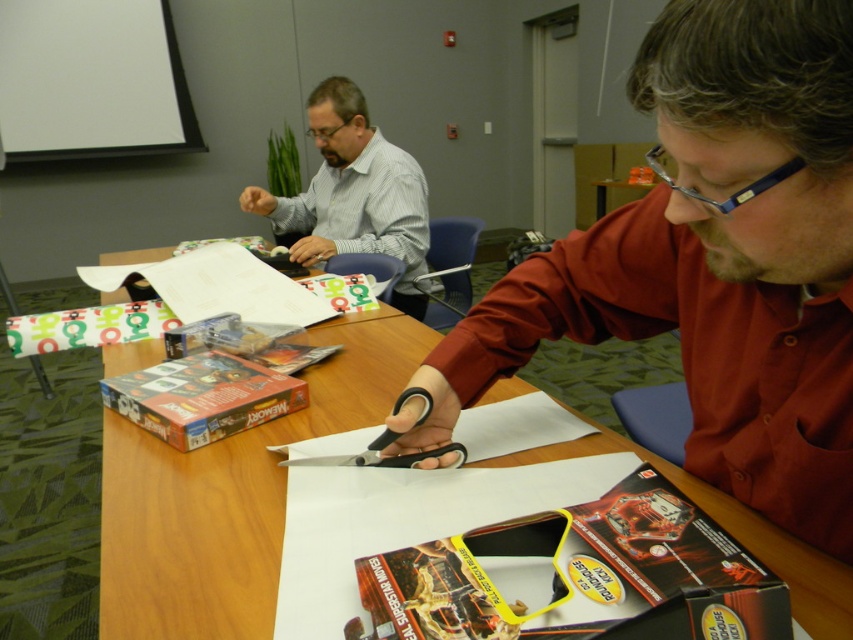
Question: Which of the following is the farthest from the observer?

Choices:
 (A) (525, 356)
 (B) (146, 397)

Answer: (B)

Question: Which point is farther to the camera?

Choices:
 (A) (813, 3)
 (B) (259, 408)

Answer: (B)

Question: Is matte plastic board game at center positioned before white paper at center?

Choices:
 (A) yes
 (B) no

Answer: (A)

Question: In this image, where is matte plastic board game at center located relative to matte gray shirt at upper left?

Choices:
 (A) left
 (B) right

Answer: (B)

Question: Which object appears closest to the camera in this image?

Choices:
 (A) wooden table at center
 (B) matte plastic board game at center
 (C) white paper at center
 (D) matte cardboard box at center

Answer: (B)

Question: Can you confirm if matte plastic board game at center is positioned to the right of white paper at center?

Choices:
 (A) yes
 (B) no

Answer: (A)